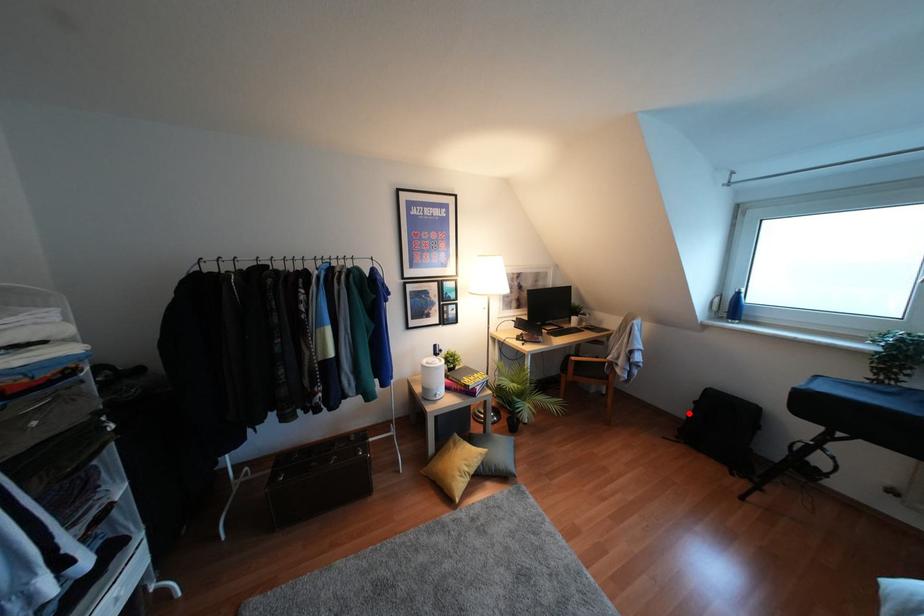
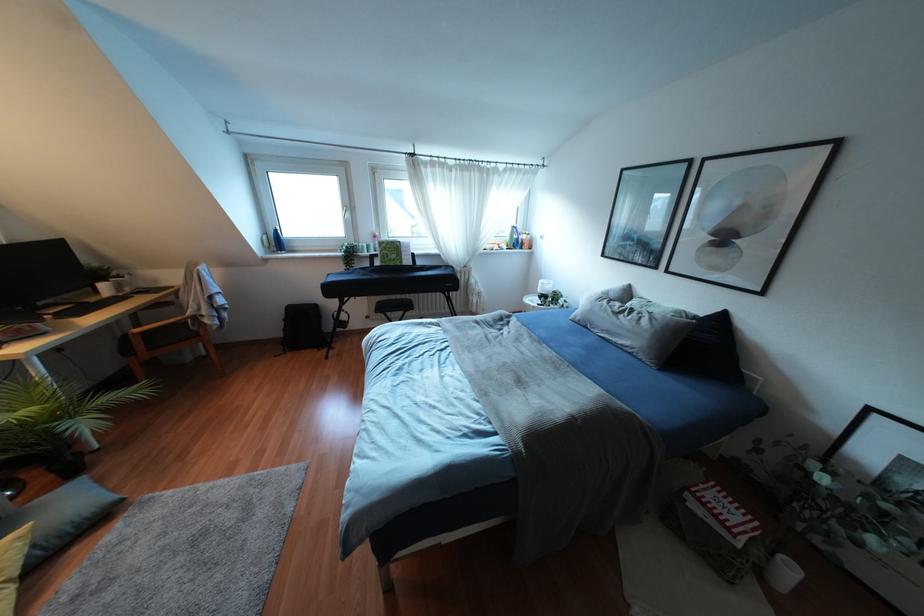
Find the pixel in the second image that matches the highlighted location in the first image.

(284, 329)